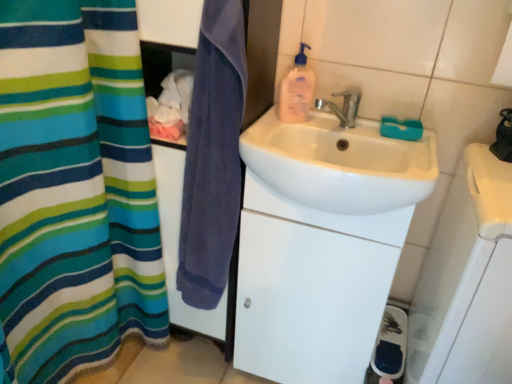
Question: Is metallic silver faucet at upper center bigger than white plastic soap dish at right?

Choices:
 (A) no
 (B) yes

Answer: (A)

Question: Is metallic silver faucet at upper center looking in the opposite direction of white plastic soap dish at right?

Choices:
 (A) no
 (B) yes

Answer: (A)

Question: Is metallic silver faucet at upper center smaller than white plastic soap dish at right?

Choices:
 (A) yes
 (B) no

Answer: (A)

Question: Is the surface of metallic silver faucet at upper center in direct contact with white plastic soap dish at right?

Choices:
 (A) yes
 (B) no

Answer: (B)

Question: Does metallic silver faucet at upper center contain white plastic soap dish at right?

Choices:
 (A) no
 (B) yes

Answer: (A)

Question: Considering the relative positions of metallic silver faucet at upper center and white plastic soap dish at right in the image provided, is metallic silver faucet at upper center to the left or to the right of white plastic soap dish at right?

Choices:
 (A) left
 (B) right

Answer: (A)

Question: From their relative heights in the image, would you say metallic silver faucet at upper center is taller or shorter than white plastic soap dish at right?

Choices:
 (A) tall
 (B) short

Answer: (B)

Question: Is metallic silver faucet at upper center inside the boundaries of white plastic soap dish at right, or outside?

Choices:
 (A) inside
 (B) outside

Answer: (B)

Question: Is point (353, 102) positioned closer to the camera than point (489, 291)?

Choices:
 (A) closer
 (B) farther

Answer: (B)

Question: Is white glossy cabinet at center inside or outside of purple cotton towel at center?

Choices:
 (A) outside
 (B) inside

Answer: (A)

Question: Considering the positions of white glossy cabinet at center and purple cotton towel at center in the image, is white glossy cabinet at center bigger or smaller than purple cotton towel at center?

Choices:
 (A) small
 (B) big

Answer: (B)

Question: Considering the positions of white glossy cabinet at center and purple cotton towel at center in the image, is white glossy cabinet at center taller or shorter than purple cotton towel at center?

Choices:
 (A) tall
 (B) short

Answer: (A)

Question: From the image's perspective, is white glossy cabinet at center positioned above or below purple cotton towel at center?

Choices:
 (A) above
 (B) below

Answer: (B)

Question: Based on their positions, is white glossy cabinet at center located to the left or right of white glossy sink at center?

Choices:
 (A) left
 (B) right

Answer: (A)

Question: Do you think white glossy cabinet at center is within white glossy sink at center, or outside of it?

Choices:
 (A) outside
 (B) inside

Answer: (A)